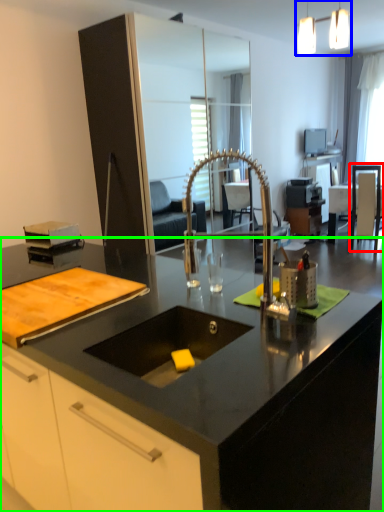
Question: Which object is the farthest from armchair (highlighted by a red box)? Choose among these: light fixture (highlighted by a blue box) or countertop (highlighted by a green box).

Choices:
 (A) light fixture
 (B) countertop

Answer: (B)